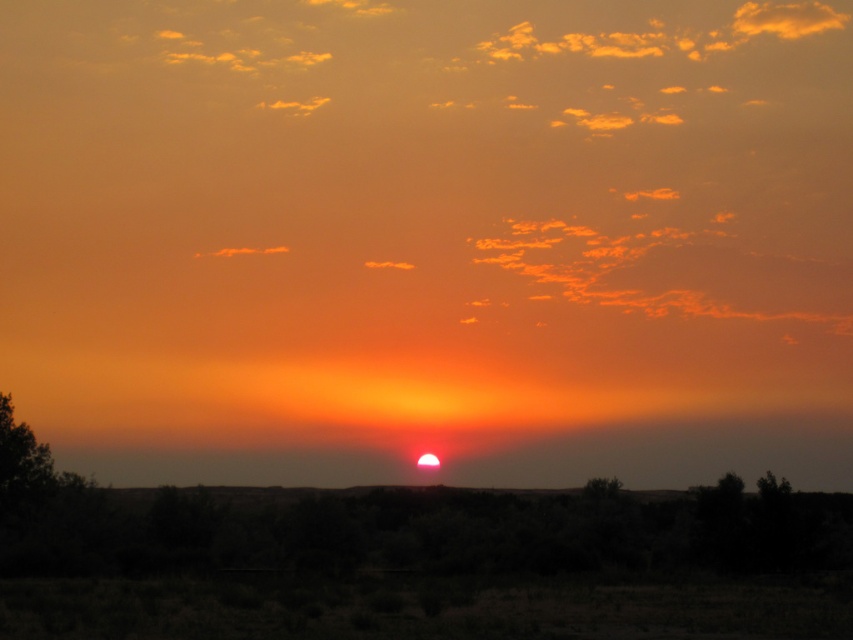
Question: Is green leafy tree at center to the right of green matte tree at center from the viewer's perspective?

Choices:
 (A) no
 (B) yes

Answer: (B)

Question: Can you confirm if green leafy tree at center is smaller than green matte tree at center?

Choices:
 (A) yes
 (B) no

Answer: (A)

Question: Among these points, which one is nearest to the camera?

Choices:
 (A) (583, 488)
 (B) (764, 490)

Answer: (B)

Question: Which point is farther to the camera?

Choices:
 (A) green leafy tree at center
 (B) green matte tree at center

Answer: (B)

Question: Can you confirm if green leafy tree at center is wider than green matte tree at center?

Choices:
 (A) no
 (B) yes

Answer: (A)